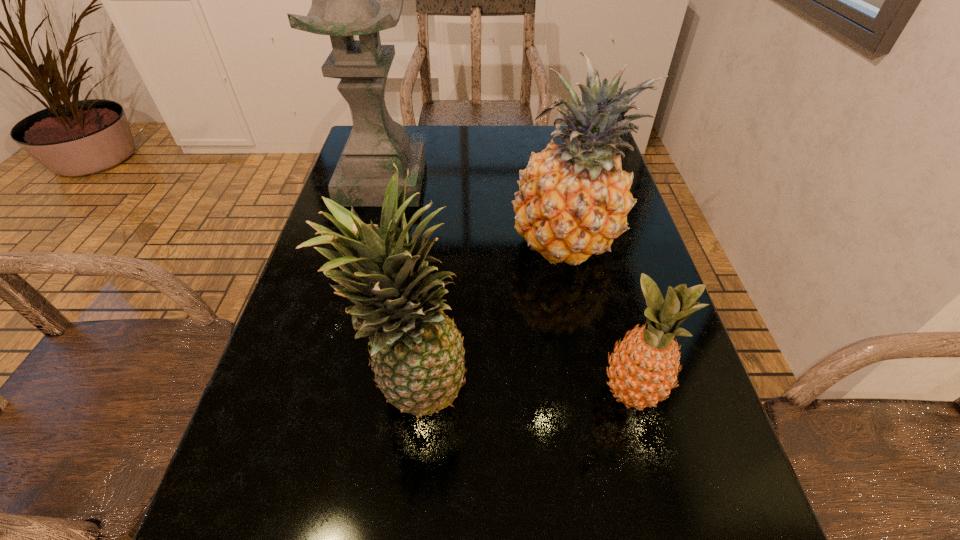
At what (x,y) coordinates should I click in order to perform the action: click on sculpture. Please return your answer as a coordinate pair (x, y). This screenshot has height=540, width=960. Looking at the image, I should click on (344, 4).

At what (x,y) coordinates should I click in order to perform the action: click on the tallest object. Please return your answer as a coordinate pair (x, y). The height and width of the screenshot is (540, 960). Looking at the image, I should click on [x=344, y=4].

Identify the location of the leftmost pineapple. This screenshot has height=540, width=960. (417, 353).

Where is `the farthest pineapple`? The width and height of the screenshot is (960, 540). the farthest pineapple is located at coordinates (573, 200).

This screenshot has height=540, width=960. I want to click on the shortest pineapple, so coord(643,369).

This screenshot has width=960, height=540. I want to click on free space located at the front opening of the farthest object, so click(x=372, y=221).

This screenshot has height=540, width=960. I want to click on vacant space located on the right of the leftmost pineapple, so click(x=660, y=389).

Image resolution: width=960 pixels, height=540 pixels. In order to click on free space located on the back of the second farthest object in this screenshot , I will do `click(552, 165)`.

The width and height of the screenshot is (960, 540). I want to click on free space located on the back of the shortest object, so click(x=596, y=261).

Where is `object at the far edge`? object at the far edge is located at coordinates (344, 4).